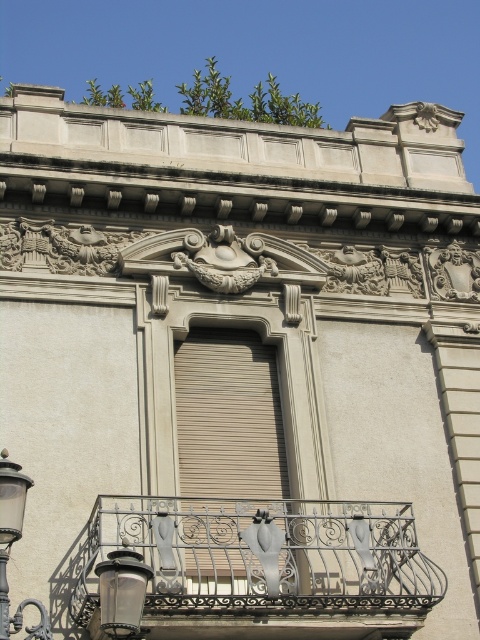
Who is lower down, wrought iron balcony at center or beige matte shutter at center?

wrought iron balcony at center is below.

Is wrought iron balcony at center smaller than beige matte shutter at center?

Actually, wrought iron balcony at center might be larger than beige matte shutter at center.

Is point (196, 561) in front of point (254, 438)?

Yes, it is.

Locate an element on the screen. This screenshot has height=640, width=480. wrought iron balcony at center is located at coordinates (265, 564).

Which is more to the right, beige matte shutter at center or matte black lantern at lower left?

From the viewer's perspective, beige matte shutter at center appears more on the right side.

Based on the photo, can you confirm if beige matte shutter at center is shorter than matte black lantern at lower left?

No, beige matte shutter at center is not shorter than matte black lantern at lower left.

Who is more forward, (x=245, y=520) or (x=119, y=627)?

Positioned in front is point (x=119, y=627).

Find the location of a particular element. beige matte shutter at center is located at coordinates (226, 444).

Locate an element on the screen. wrought iron balcony at center is located at coordinates (265, 564).

Can you confirm if wrought iron balcony at center is bigger than metallic streetlamp at lower left?

Correct, wrought iron balcony at center is larger in size than metallic streetlamp at lower left.

Is point (348, 502) positioned in front of point (3, 598)?

No, it is behind (3, 598).

Image resolution: width=480 pixels, height=640 pixels. Find the location of `wrought iron balcony at center`. wrought iron balcony at center is located at coordinates (265, 564).